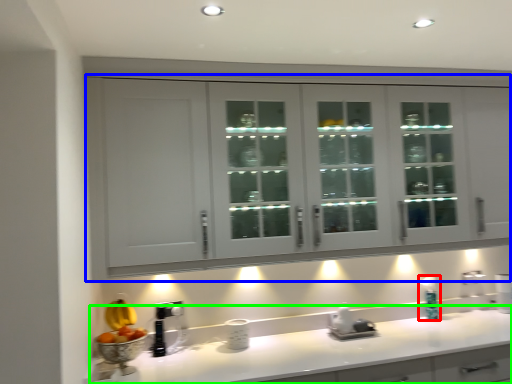
Question: Considering the real-world distances, which object is farthest from soap dispenser (highlighted by a red box)? cabinetry (highlighted by a blue box) or countertop (highlighted by a green box)?

Choices:
 (A) cabinetry
 (B) countertop

Answer: (A)